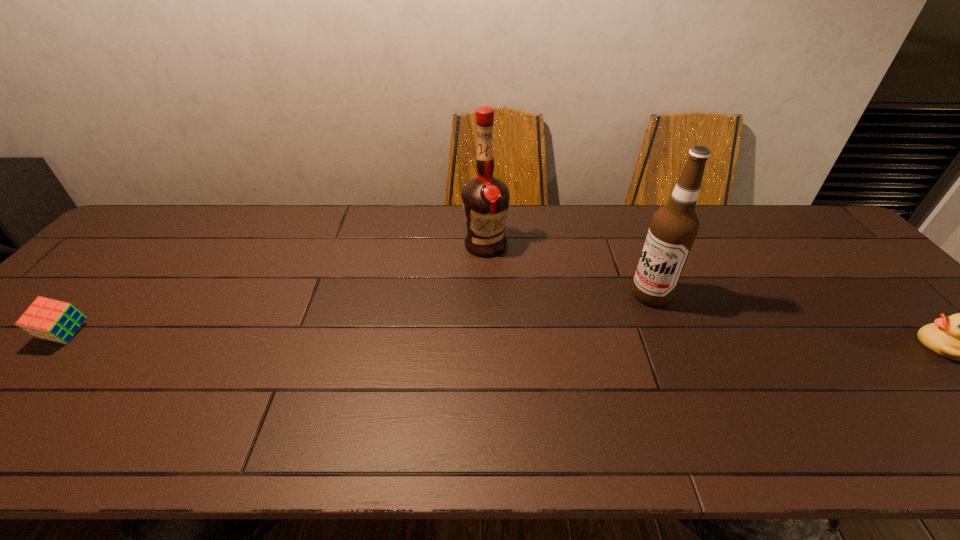
Image resolution: width=960 pixels, height=540 pixels. I want to click on vacant spot on the desktop that is between the leftmost object and the duckling and is positioned on the label of the second farthest object, so click(x=590, y=341).

Locate an element on the screen. The width and height of the screenshot is (960, 540). vacant spot on the desktop that is between the cube and the duckling and is positioned on the front and back of the second object from left to right is located at coordinates (470, 340).